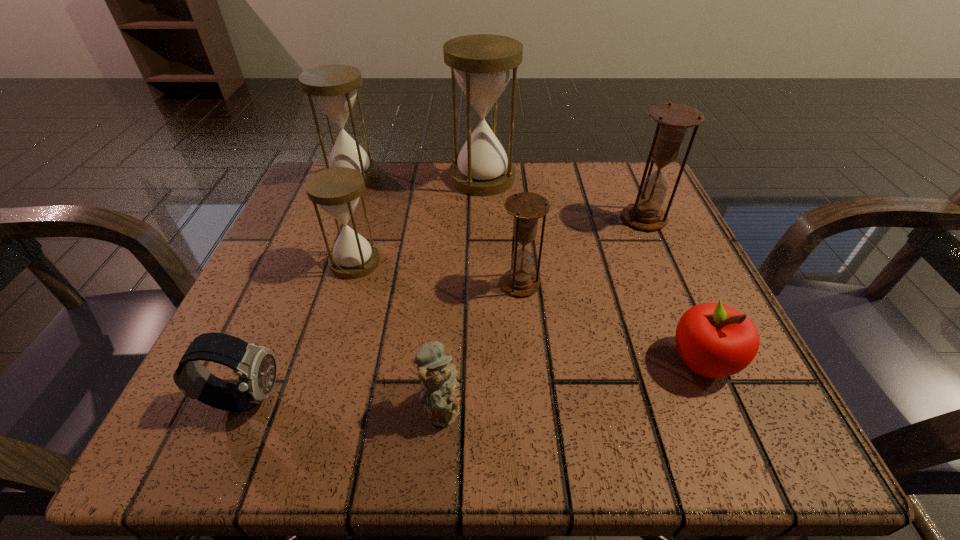
Locate an element on the screen. blank space at the near edge of the desktop is located at coordinates (404, 440).

This screenshot has width=960, height=540. Identify the location of free space at the left edge. (280, 309).

The height and width of the screenshot is (540, 960). I want to click on vacant space at the right edge of the desktop, so click(666, 339).

This screenshot has height=540, width=960. In order to click on free point at the far left corner in this screenshot , I will do `click(371, 218)`.

In the image, there is a desktop. At what (x,y) coordinates should I click in order to perform the action: click on free space at the far right corner. Please return your answer as a coordinate pair (x, y). Looking at the image, I should click on (613, 164).

What are the coordinates of `vacant space that's between the rightmost white hourglass and the nearest white hourglass` in the screenshot? It's located at (419, 220).

Identify the location of vacant region between the third farthest hourglass and the blue teddy bear. (543, 313).

You are a GUI agent. You are given a task and a screenshot of the screen. Output one action in this format:
    pyautogui.click(x=<x>, y=<y>)
    Task: Click on the blank region between the second biggest white hourglass and the left brown hourglass
    This screenshot has width=960, height=540.
    Given the screenshot: What is the action you would take?
    pyautogui.click(x=436, y=230)

At what (x,y) coordinates should I click in order to perform the action: click on vacant space that is in between the tallest object and the farther brown hourglass. Please return your answer as a coordinate pair (x, y). This screenshot has width=960, height=540. Looking at the image, I should click on (564, 198).

Where is `free space between the apple and the teddy bear`? The height and width of the screenshot is (540, 960). free space between the apple and the teddy bear is located at coordinates (572, 383).